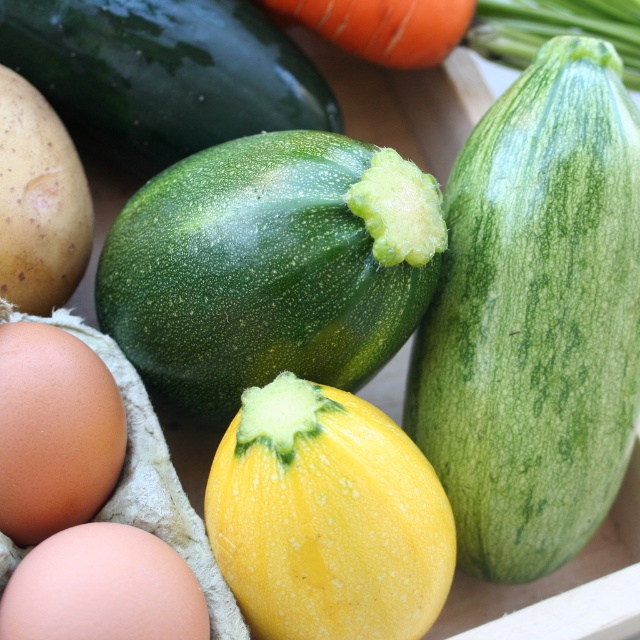
Question: Does green matte zucchini at upper center have a greater width compared to orange smooth carrot at upper center?

Choices:
 (A) yes
 (B) no

Answer: (A)

Question: Which object is farther from the camera taking this photo?

Choices:
 (A) smooth brown potato at left
 (B) orange smooth carrot at upper center

Answer: (B)

Question: Is yellow matte squash at center to the right of smooth brown egg at lower left from the viewer's perspective?

Choices:
 (A) no
 (B) yes

Answer: (B)

Question: Is yellow matte squash at center in front of brown matte egg at lower left?

Choices:
 (A) yes
 (B) no

Answer: (A)

Question: Which of the following is the farthest from the observer?

Choices:
 (A) (88, 436)
 (B) (163, 592)
 (C) (67, 198)
 (D) (298, 163)

Answer: (C)

Question: Which point is closer to the camera taking this photo?

Choices:
 (A) (321, 26)
 (B) (188, 182)

Answer: (B)